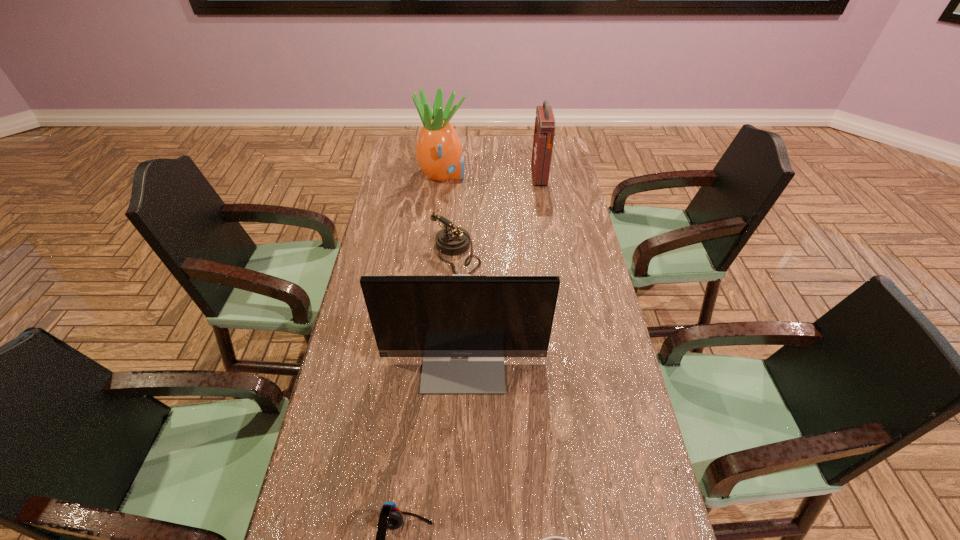
What are the coordinates of `vacant point located between the telephone and the pineapple` in the screenshot? It's located at [x=449, y=215].

Point out which object is positioned as the fifth nearest to the first-aid kit. Please provide its 2D coordinates. Your answer should be formatted as a tuple, i.e. [(x, y)], where the tuple contains the x and y coordinates of a point satisfying the conditions above.

[(553, 539)]

Find the location of `object that is the third closest to the computer monitor`. object that is the third closest to the computer monitor is located at coordinates (553, 539).

At what (x,y) coordinates should I click in order to perform the action: click on free spot that satisfies the following two spatial constraints: 1. on the back side of the telephone; 2. at the entrance of the pineapple. Please return your answer as a coordinate pair (x, y). The width and height of the screenshot is (960, 540). Looking at the image, I should click on (461, 175).